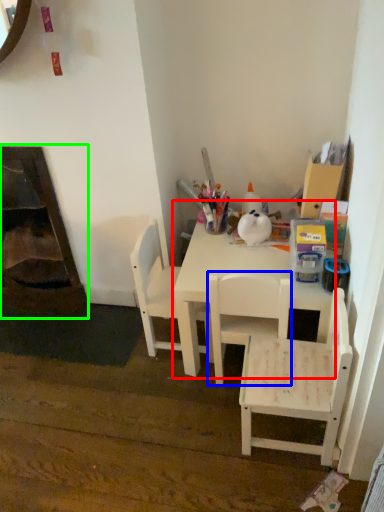
Question: Based on their relative distances, which object is farther from table (highlighted by a red box)? Choose from chair (highlighted by a blue box) and fireplace (highlighted by a green box).

Choices:
 (A) chair
 (B) fireplace

Answer: (B)